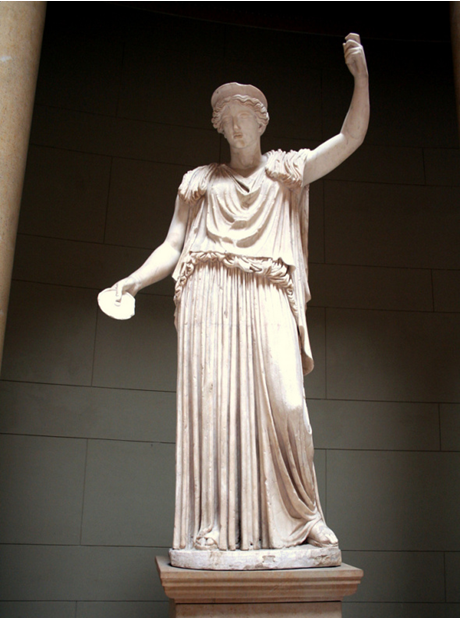
Locate an element on the screen. This screenshot has width=461, height=618. pedestal is located at coordinates (261, 586).